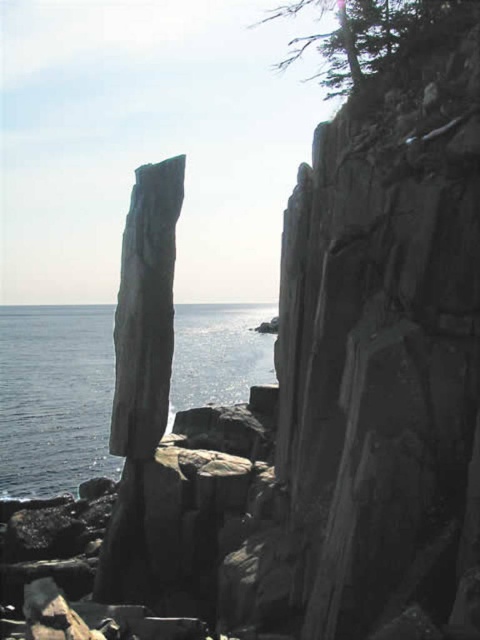
Question: Does blue water at center appear on the right side of green textured tree at upper center?

Choices:
 (A) yes
 (B) no

Answer: (B)

Question: Can you confirm if blue water at center is positioned above green textured tree at upper center?

Choices:
 (A) yes
 (B) no

Answer: (B)

Question: Which of the following is the closest to the observer?

Choices:
 (A) (87, 392)
 (B) (457, 1)

Answer: (B)

Question: Which point is farther to the camera?

Choices:
 (A) (12, 344)
 (B) (356, 44)

Answer: (A)

Question: Which of the following is the farthest from the observer?

Choices:
 (A) blue water at center
 (B) green textured tree at upper center

Answer: (A)

Question: Is blue water at center below green textured tree at upper center?

Choices:
 (A) no
 (B) yes

Answer: (B)